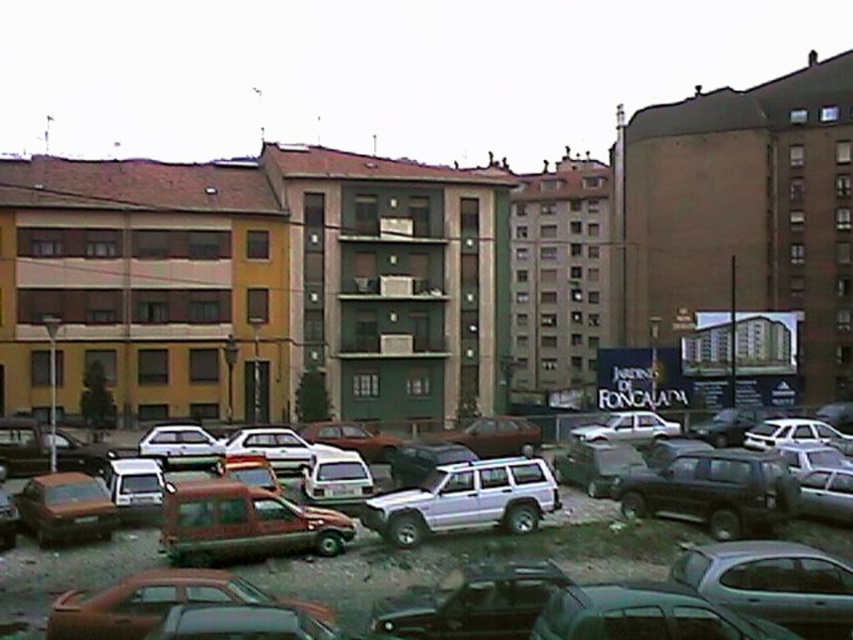
Question: Which point appears farthest from the camera in this image?

Choices:
 (A) (664, 422)
 (B) (428, 472)

Answer: (A)

Question: Is shiny black suv at center right to the left of satin silver suv at center from the viewer's perspective?

Choices:
 (A) yes
 (B) no

Answer: (B)

Question: Which point is farther to the camera?

Choices:
 (A) rusty metallic van at lower left
 (B) shiny black suv at center right
 (C) satin silver suv at center

Answer: (B)

Question: Can you confirm if metallic red van at center is positioned to the right of satin silver suv at center?

Choices:
 (A) no
 (B) yes

Answer: (A)

Question: Which point is farther to the camera?

Choices:
 (A) (619, 436)
 (B) (468, 467)
 (C) (85, 557)

Answer: (A)

Question: Does shiny black suv at center right have a lesser width compared to rusty metallic van at lower left?

Choices:
 (A) no
 (B) yes

Answer: (B)